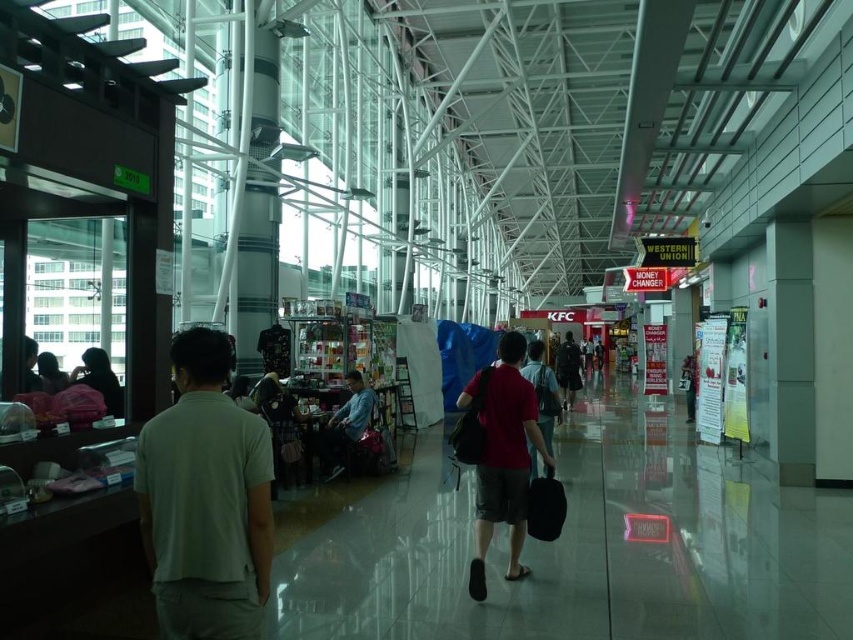
You are a customer in the mall and you see two shirts displayed at the kiosk. The light green cotton polo shirt at left and the matte red shirt at center. Which shirt is positioned more to the left side?

The light green cotton polo shirt at left is positioned more to the left side than the matte red shirt at center.